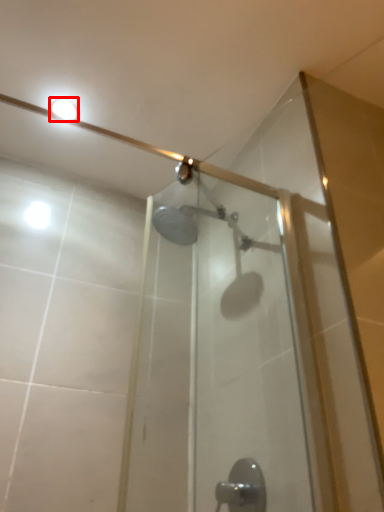
Question: Observing the image, what is the correct spatial positioning of light fixture (annotated by the red box) in reference to door handle?

Choices:
 (A) right
 (B) left

Answer: (B)